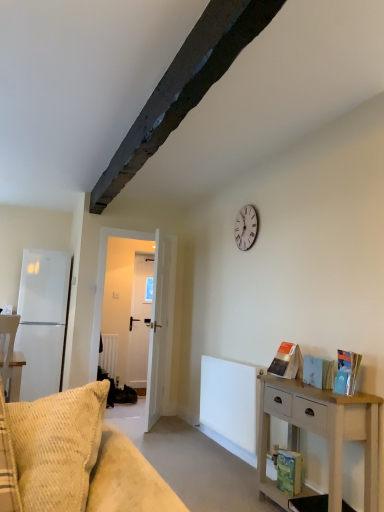
What is the approximate height of white wooden door at center?

white wooden door at center is 2.06 meters tall.

Measure the distance between white wooden door at center and camera.

They are 14.95 feet apart.

The image size is (384, 512). Describe the element at coordinates (230, 401) in the screenshot. I see `white ribbed radiator at center` at that location.

Image resolution: width=384 pixels, height=512 pixels. Identify the location of white matte refrigerator at left. (43, 320).

Image resolution: width=384 pixels, height=512 pixels. Describe the element at coordinates (318, 372) in the screenshot. I see `white paper book at right, which is the second book in top-to-bottom order` at that location.

Image resolution: width=384 pixels, height=512 pixels. What do you see at coordinates (320, 433) in the screenshot? I see `light wood nightstand at right` at bounding box center [320, 433].

Describe the element at coordinates (289, 471) in the screenshot. The image size is (384, 512). I see `hardcover book at lower right, the first book ordered from the bottom` at that location.

The image size is (384, 512). Identify the location of orange matte book at right, which ranks as the third book in top-to-bottom order. (287, 361).

Would you consider white paper book at right, acting as the 3th book starting from the back, to be distant from white ribbed radiator at center?

white paper book at right, acting as the 3th book starting from the back, is actually quite close to white ribbed radiator at center.

Is white paper book at right, the second book when ordered from front to back, facing away from white ribbed radiator at center?

No, white paper book at right, the second book when ordered from front to back, is not facing away from white ribbed radiator at center.

Based on the photo, in terms of width, does white paper book at right, the second book when ordered from front to back, look wider or thinner when compared to white ribbed radiator at center?

Clearly, white paper book at right, the second book when ordered from front to back, has less width compared to white ribbed radiator at center.

Is white ribbed radiator at center looking in the opposite direction of white wooden clock at upper center?

No, white ribbed radiator at center is not facing the opposite direction of white wooden clock at upper center.

At what (x,y) coordinates should I click in order to perform the action: click on clock that is above the white ribbed radiator at center (from a real-world perspective). Please return your answer as a coordinate pair (x, y). The height and width of the screenshot is (512, 384). Looking at the image, I should click on (246, 227).

From a real-world perspective, between white ribbed radiator at center and white wooden clock at upper center, who is vertically higher?

white wooden clock at upper center is physically above.

Consider the image. From a real-world perspective, which is physically below, hardcover book at right, positioned as the 1th book in top-to-bottom order, or white wooden clock at upper center?

From a 3D spatial view, hardcover book at right, positioned as the 1th book in top-to-bottom order, is below.

In terms of height, does hardcover book at right, marked as the 4th book in a back-to-front arrangement, look taller or shorter compared to white wooden clock at upper center?

Considering their sizes, hardcover book at right, marked as the 4th book in a back-to-front arrangement, has less height than white wooden clock at upper center.

Does hardcover book at right, positioned as the 1th book in top-to-bottom order, appear on the right side of white wooden clock at upper center?

Indeed, hardcover book at right, positioned as the 1th book in top-to-bottom order, is positioned on the right side of white wooden clock at upper center.

Which of these two, light wood nightstand at right or white paper book at right, the third book in the bottom-to-top sequence, is wider?

light wood nightstand at right.

From the image's perspective, would you say light wood nightstand at right is shown under white paper book at right, the third book in the bottom-to-top sequence?

Indeed, from the image's perspective, light wood nightstand at right is shown beneath white paper book at right, the third book in the bottom-to-top sequence.

Considering the positions of objects light wood nightstand at right and white paper book at right, the second book when ordered from front to back, in the image provided, who is behind, light wood nightstand at right or white paper book at right, the second book when ordered from front to back,?

white paper book at right, the second book when ordered from front to back, is behind.

Between light wood nightstand at right and white paper book at right, the second book when ordered from front to back, which one has more height?

light wood nightstand at right is taller.

Which of these two, white wooden door at center or white wooden clock at upper center, is bigger?

With larger size is white wooden door at center.

Does white wooden door at center come behind white wooden clock at upper center?

Yes, white wooden door at center is further from the viewer.

Identify the location of door behind the white wooden clock at upper center. The image size is (384, 512). (104, 281).

Can you tell me how much white wooden door at center and white wooden clock at upper center differ in facing direction?

They differ by 88.9 degrees in their facing directions.

Is hardcover book at right, the 1th book from the front, located within light wood nightstand at right?

No, hardcover book at right, the 1th book from the front, is located outside of light wood nightstand at right.

Which point is more forward, (326, 430) or (347, 374)?

Positioned in front is point (326, 430).

Looking at this image, relative to hardcover book at right, marked as the 4th book in a back-to-front arrangement, is light wood nightstand at right in front or behind?

light wood nightstand at right is positioned closer to the viewer than hardcover book at right, marked as the 4th book in a back-to-front arrangement.

Looking at this image, can you confirm if hardcover book at lower right, the second book when ordered from back to front, is positioned to the left of orange matte book at right, the 2th book when ordered from bottom to top?

Correct, you'll find hardcover book at lower right, the second book when ordered from back to front, to the left of orange matte book at right, the 2th book when ordered from bottom to top.

Is hardcover book at lower right, the second book when ordered from back to front, closer to camera compared to orange matte book at right, which is the fourth book in front-to-back order?

Yes, it is.

Can you confirm if hardcover book at lower right, the second book when ordered from back to front, is thinner than orange matte book at right, which is counted as the 1th book, starting from the back?

Yes, hardcover book at lower right, the second book when ordered from back to front, is thinner than orange matte book at right, which is counted as the 1th book, starting from the back.

Does hardcover book at lower right, the first book ordered from the bottom, have a larger size compared to orange matte book at right, which is the fourth book in front-to-back order?

No.

Where is `radiator below the white paper book at right, the third book in the bottom-to-top sequence (from the image's perspective)`? The image size is (384, 512). radiator below the white paper book at right, the third book in the bottom-to-top sequence (from the image's perspective) is located at coordinates (230, 401).

Where is `radiator to the left of white wooden clock at upper center`? radiator to the left of white wooden clock at upper center is located at coordinates tap(230, 401).

Considering their positions, is hardcover book at right, positioned as the fourth book in bottom-to-top order, positioned further to orange matte book at right, which ranks as the third book in top-to-bottom order, than white ribbed radiator at center?

Among the two, white ribbed radiator at center is located further to orange matte book at right, which ranks as the third book in top-to-bottom order.

Looking at the image, which one is located closer to white wooden clock at upper center, white paper book at right, which is the second book in top-to-bottom order, or light wood nightstand at right?

white paper book at right, which is the second book in top-to-bottom order.

When comparing their distances from white wooden door at center, does light wood nightstand at right or white wooden clock at upper center seem closer?

white wooden clock at upper center is closer to white wooden door at center.

When comparing their distances from white ribbed radiator at center, does hardcover book at right, positioned as the fourth book in bottom-to-top order, or white wooden clock at upper center seem further?

The object further to white ribbed radiator at center is white wooden clock at upper center.

From the image, which object appears to be nearer to light wood nightstand at right, orange matte book at right, which is counted as the 1th book, starting from the back, or hardcover book at lower right, the fourth book positioned from the top?

hardcover book at lower right, the fourth book positioned from the top, is positioned closer to the anchor light wood nightstand at right.

Which object lies further to the anchor point orange matte book at right, which ranks as the third book in top-to-bottom order, light wood nightstand at right or white matte refrigerator at left?

white matte refrigerator at left.

When comparing their distances from hardcover book at right, positioned as the fourth book in bottom-to-top order, does light wood nightstand at right or white ribbed radiator at center seem further?

white ribbed radiator at center is further to hardcover book at right, positioned as the fourth book in bottom-to-top order.

Estimate the real-world distances between objects in this image. Which object is further from hardcover book at right, marked as the 4th book in a back-to-front arrangement, white wooden clock at upper center or light wood nightstand at right?

white wooden clock at upper center is further to hardcover book at right, marked as the 4th book in a back-to-front arrangement.

Identify the location of door between hardcover book at right, positioned as the fourth book in bottom-to-top order, and white matte refrigerator at left, along the z-axis. The height and width of the screenshot is (512, 384). point(104,281).

Where is `book situated between white matte refrigerator at left and orange matte book at right, which is counted as the 1th book, starting from the back, from left to right`? book situated between white matte refrigerator at left and orange matte book at right, which is counted as the 1th book, starting from the back, from left to right is located at coordinates (289, 471).

Where is `nightstand between white matte refrigerator at left and hardcover book at right, positioned as the fourth book in bottom-to-top order, in the horizontal direction`? nightstand between white matte refrigerator at left and hardcover book at right, positioned as the fourth book in bottom-to-top order, in the horizontal direction is located at coordinates (320, 433).

This screenshot has width=384, height=512. I want to click on door between hardcover book at lower right, the fourth book positioned from the top, and white matte refrigerator at left, along the z-axis, so pos(104,281).